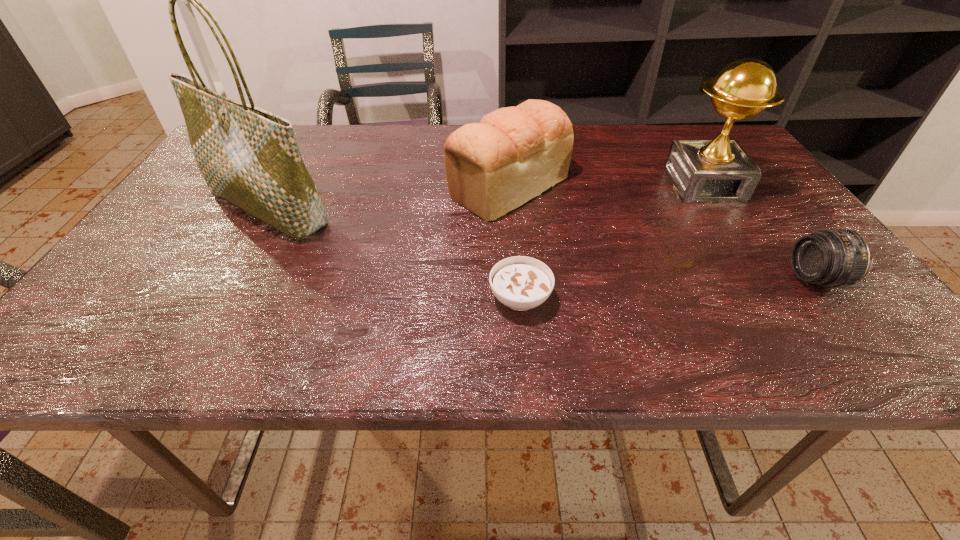
Find the location of a particular element. free point between the soup bowl and the award is located at coordinates (612, 241).

This screenshot has height=540, width=960. Find the location of `vacant point located between the bread and the second tallest object`. vacant point located between the bread and the second tallest object is located at coordinates (607, 185).

Image resolution: width=960 pixels, height=540 pixels. I want to click on free point between the shortest object and the bread, so click(x=515, y=242).

At what (x,y) coordinates should I click in order to perform the action: click on vacant point located between the bread and the telephoto lens. Please return your answer as a coordinate pair (x, y). The height and width of the screenshot is (540, 960). Looking at the image, I should click on (661, 232).

At what (x,y) coordinates should I click in order to perform the action: click on empty location between the shortest object and the third shortest object. Please return your answer as a coordinate pair (x, y). This screenshot has width=960, height=540. Looking at the image, I should click on point(515,242).

Where is `vacant area that lies between the telephoto lens and the tallest object`? This screenshot has height=540, width=960. vacant area that lies between the telephoto lens and the tallest object is located at coordinates (541, 244).

Identify the location of vacant area between the second shortest object and the soup bowl. [x=667, y=288].

Find the location of a particular element. This screenshot has height=540, width=960. vacant region between the shortest object and the third tallest object is located at coordinates (515, 242).

Image resolution: width=960 pixels, height=540 pixels. Identify the location of free space between the second shortest object and the third shortest object. (661, 232).

The image size is (960, 540). I want to click on vacant area that lies between the award and the soup bowl, so 612,241.